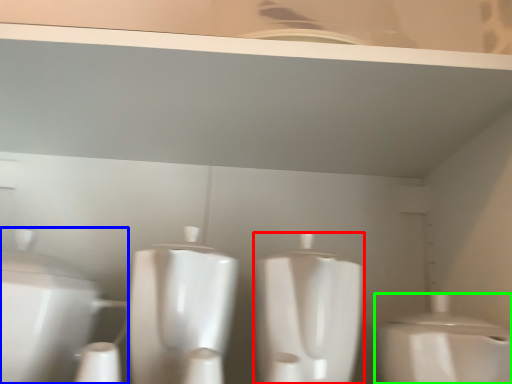
Question: Which object is the farthest from toilet (highlighted by a red box)? Choose among these: toilet (highlighted by a blue box) or toilet (highlighted by a green box).

Choices:
 (A) toilet
 (B) toilet

Answer: (A)